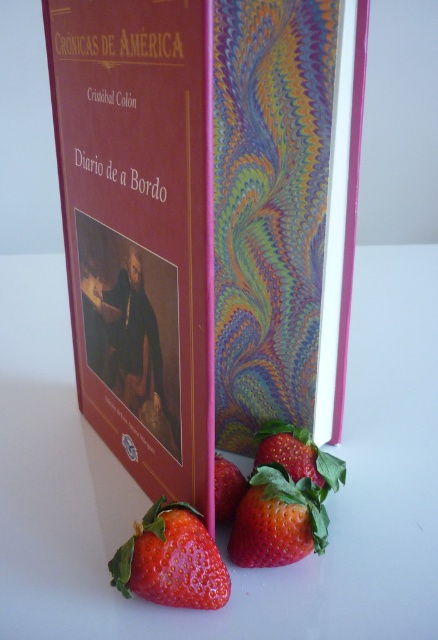
From the picture: You are organizing a display and need to place a decorative item on the white surface. The marbled paper book at center is already placed. Where should you place the new item so it doesn not overlap with the book?

To avoid overlapping with the marbled paper book at center, place the new item anywhere except the coordinates around point [204,221].

You are a food stylist arranging strawberries on a table. You have two strawberries in front of you on the table surface. One is a red matte strawberry at lower center and the other is a shiny red strawberry at lower center. Which strawberry is closer to you?

The red matte strawberry at lower center is closer to you because it is further to the viewer than the shiny red strawberry at lower center.

You are organizing a display and need to place a decorative item to the right of the red matte strawberry at lower center. Based on the current arrangement, where should you place the item relative to the marbled paper book at center?

You should place the decorative item to the right of the red matte strawberry at lower center, which would be to the right of the marbled paper book at center since the marbled paper book at center is to the left of the red matte strawberry at lower center.